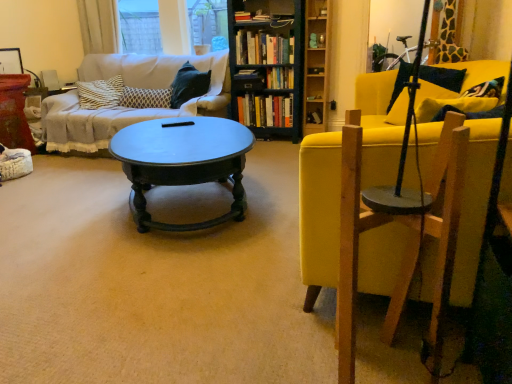
Question: In terms of size, does wooden swivel chair at right appear bigger or smaller than wooden bookshelf at center?

Choices:
 (A) small
 (B) big

Answer: (A)

Question: Considering their positions, is wooden swivel chair at right located in front of or behind wooden bookshelf at center?

Choices:
 (A) front
 (B) behind

Answer: (A)

Question: Which of these objects is positioned closest to the wooden swivel chair at right?

Choices:
 (A) matte black book at center, acting as the first book starting from the bottom
 (B) hardcover books at center, which is counted as the 5th book, starting from the top
 (C) velvet yellow chair at right
 (D) hardcover books at center, which is counted as the 6th book, starting from the bottom
 (E) hardcover book at center, arranged as the fourth book when ordered from the bottom

Answer: (C)

Question: Considering the real-world distances, which object is farthest from the velvet yellow chair at right?

Choices:
 (A) hardcover books at center, which is counted as the 6th book, starting from the bottom
 (B) shiny dark wood coffee table at center
 (C) patterned fabric pillow at center-left
 (D) wooden bookshelf at center
 (E) wooden swivel chair at right

Answer: (C)